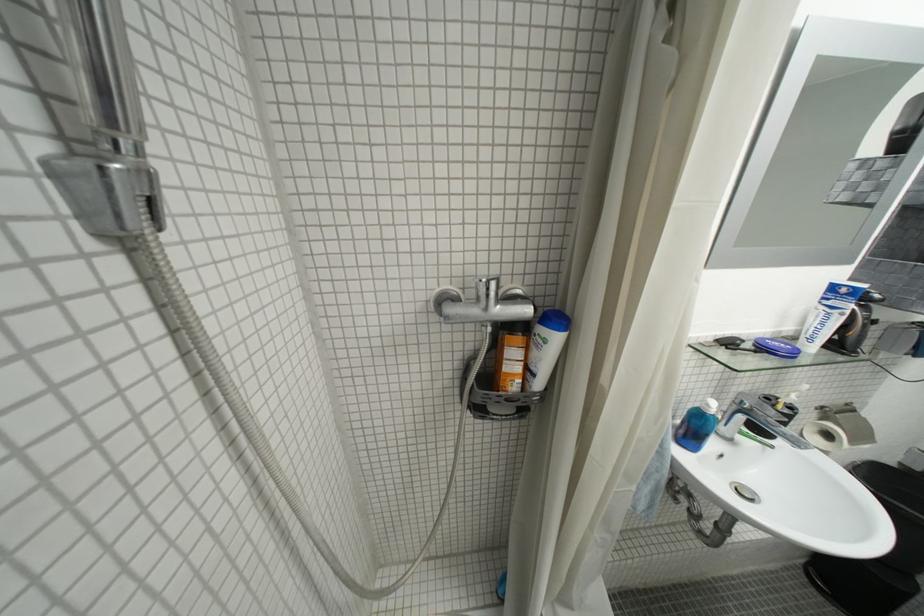
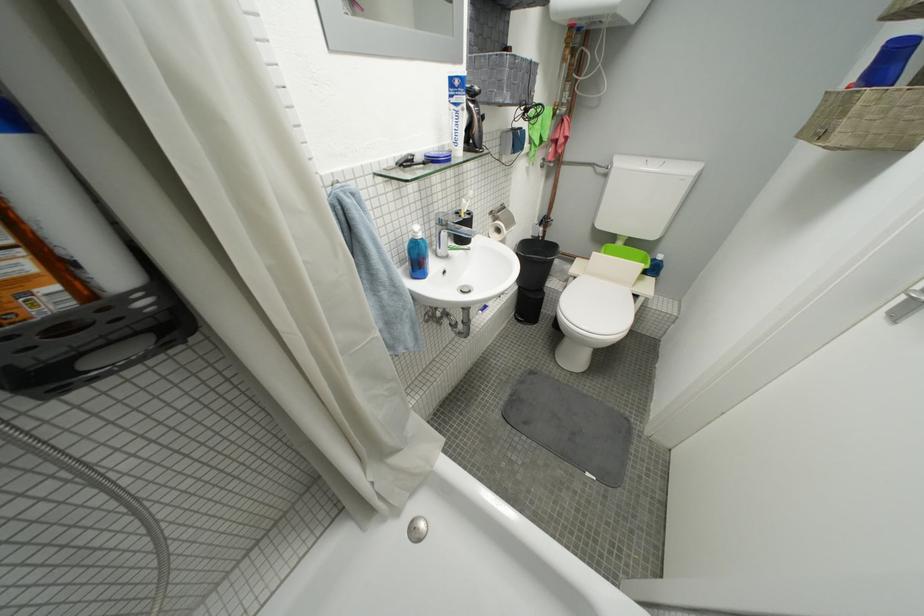
The first image is from the beginning of the video and the second image is from the end. How did the camera likely rotate when shooting the video?

The camera rotated toward right-down.